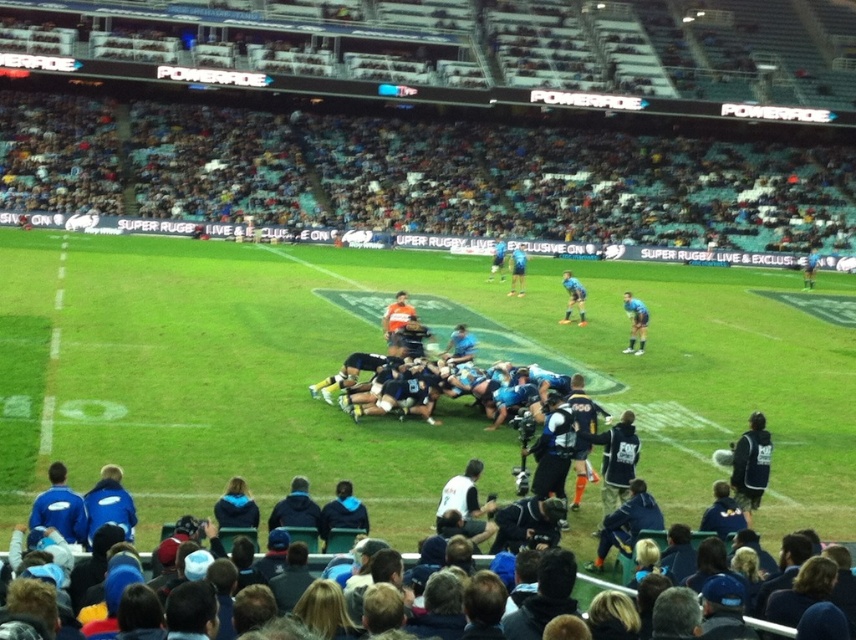
How far apart are blue fabric seats at upper center and blue fabric shirt at center?

blue fabric seats at upper center is 14.03 meters away from blue fabric shirt at center.

Who is positioned more to the right, blue fabric seats at upper center or blue fabric shirt at center?

From the viewer's perspective, blue fabric shirt at center appears more on the right side.

Between point (718, 140) and point (525, 257), which one is positioned in front?

Point (525, 257)

Image resolution: width=856 pixels, height=640 pixels. What are the coordinates of `blue fabric seats at upper center` in the screenshot? It's located at (488, 179).

Looking at this image, can you confirm if blue fabric seats at upper center is positioned to the right of blue jersey at center?

Incorrect, blue fabric seats at upper center is not on the right side of blue jersey at center.

Can you confirm if blue fabric seats at upper center is positioned below blue jersey at center?

No.

Who is more forward, [333,125] or [633,346]?

Point [633,346]

I want to click on blue fabric seats at upper center, so click(x=488, y=179).

Is point (568, 317) positioned in front of point (512, 275)?

Yes, point (568, 317) is in front of point (512, 275).

Is point (562, 275) farther from viewer compared to point (512, 256)?

Yes, it is.

Where is `blue fabric jersey at center`? This screenshot has height=640, width=856. blue fabric jersey at center is located at coordinates (574, 298).